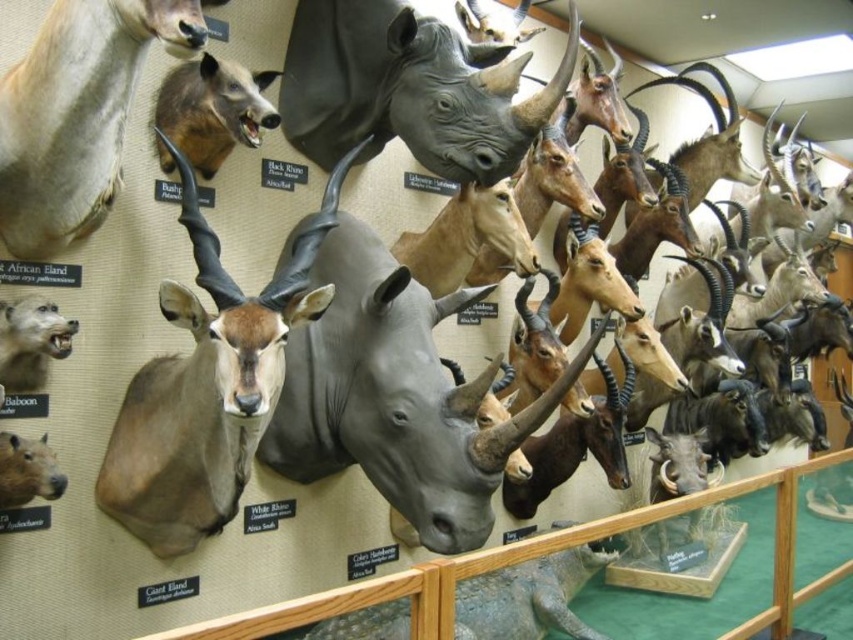
Question: Does matte gray rhinoceros at center have a lesser width compared to black matte rhinoceros at center?

Choices:
 (A) no
 (B) yes

Answer: (A)

Question: Which of the following is the closest to the observer?

Choices:
 (A) (421, 499)
 (B) (496, 179)

Answer: (A)

Question: Which object is closer to the camera taking this photo?

Choices:
 (A) matte gray rhinoceros at center
 (B) black matte rhinoceros at center

Answer: (A)

Question: Is the position of matte gray rhinoceros at center less distant than that of black matte rhinoceros at center?

Choices:
 (A) yes
 (B) no

Answer: (A)

Question: Is matte gray rhinoceros at center closer to the viewer compared to black matte rhinoceros at center?

Choices:
 (A) no
 (B) yes

Answer: (B)